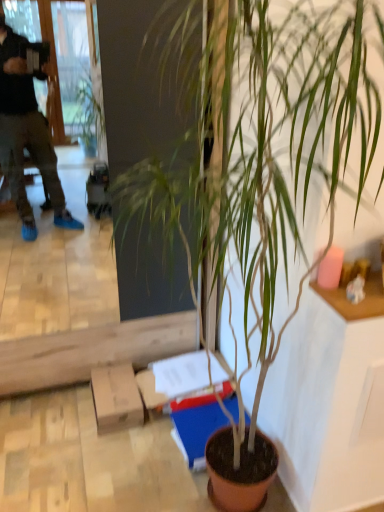
Image resolution: width=384 pixels, height=512 pixels. I want to click on empty space that is ontop of brown cardboard box at lower center (from a real-world perspective), so click(117, 382).